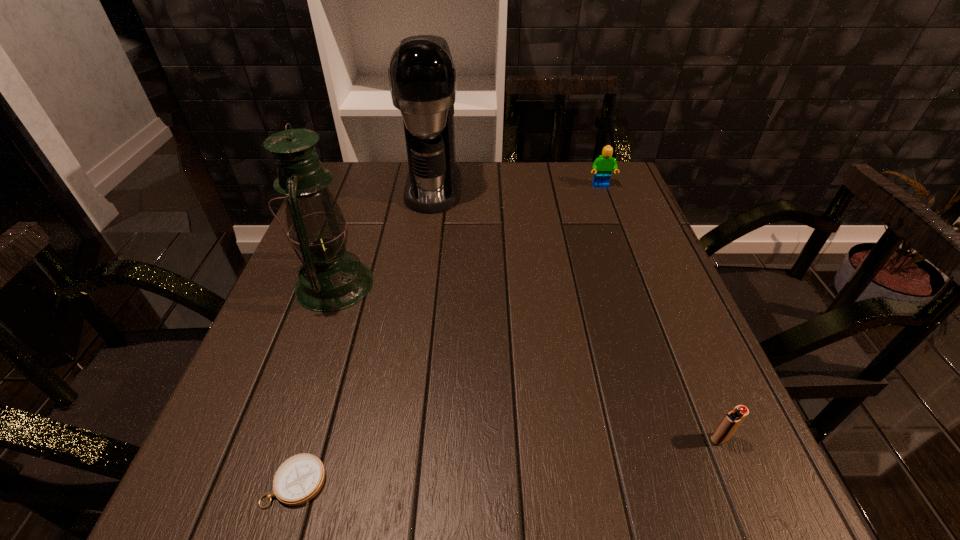
The width and height of the screenshot is (960, 540). Find the location of `object that is at the far right corner`. object that is at the far right corner is located at coordinates (603, 166).

I want to click on vacant space at the far edge of the desktop, so click(x=479, y=193).

The image size is (960, 540). I want to click on vacant area at the near edge, so click(481, 526).

Locate an element on the screen. The width and height of the screenshot is (960, 540). free spot at the left edge of the desktop is located at coordinates (253, 428).

The image size is (960, 540). In order to click on free region at the right edge in this screenshot , I will do `click(617, 325)`.

The image size is (960, 540). I want to click on free space at the far left corner of the desktop, so click(376, 199).

Where is `free space at the far right corner of the desktop`? This screenshot has width=960, height=540. free space at the far right corner of the desktop is located at coordinates (628, 202).

You are a GUI agent. You are given a task and a screenshot of the screen. Output one action in this format:
    pyautogui.click(x=<x>, y=<y>)
    Task: Click on the vacant area at the near right corner of the desktop
    
    Given the screenshot: What is the action you would take?
    pyautogui.click(x=762, y=489)

Where is `empty space between the coffee maker and the Lego`? Image resolution: width=960 pixels, height=540 pixels. empty space between the coffee maker and the Lego is located at coordinates (517, 187).

Where is `vacant area between the Lego and the coffee maker`? vacant area between the Lego and the coffee maker is located at coordinates (517, 187).